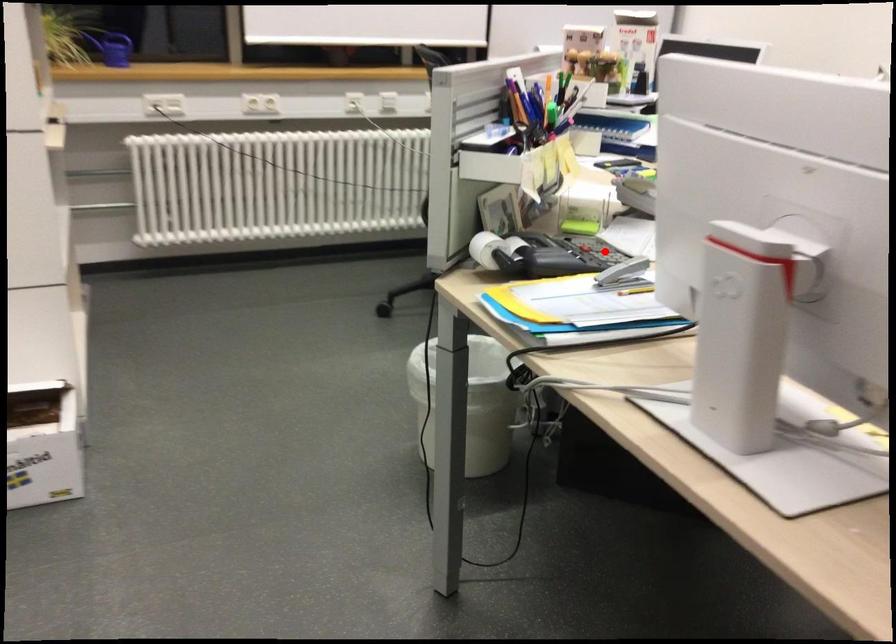
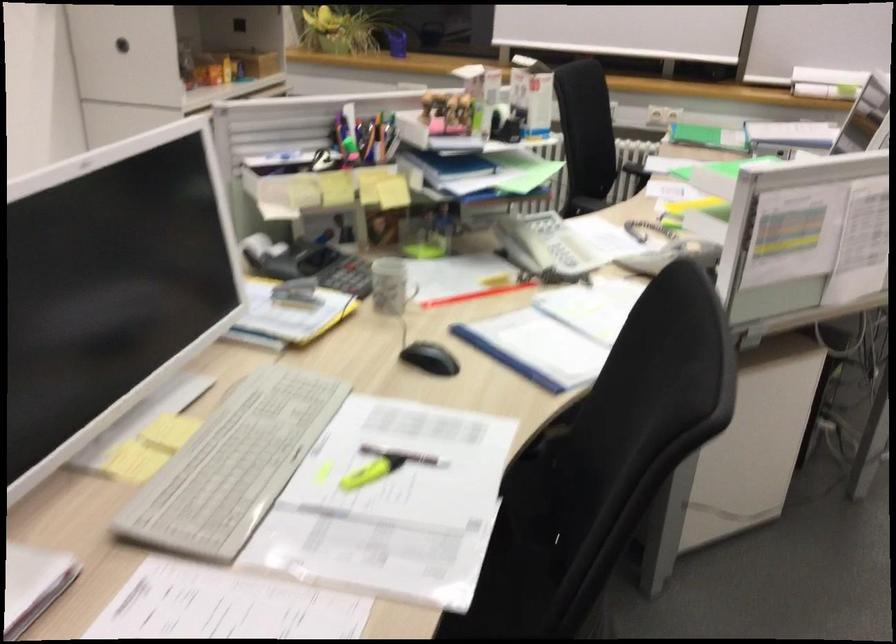
Where in the second image is the point corresponding to the highlighted location from the first image?

(348, 276)